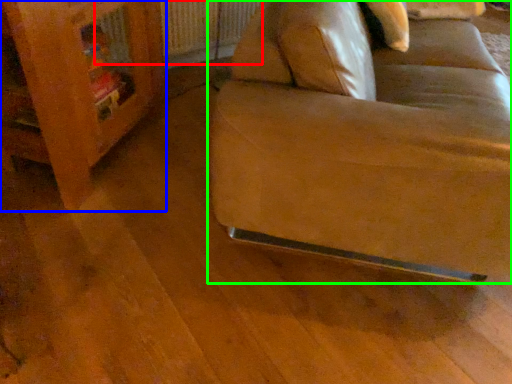
Question: Which object is the closest to the radiator (highlighted by a red box)? Choose among these: furniture (highlighted by a blue box) or studio couch (highlighted by a green box).

Choices:
 (A) furniture
 (B) studio couch

Answer: (A)